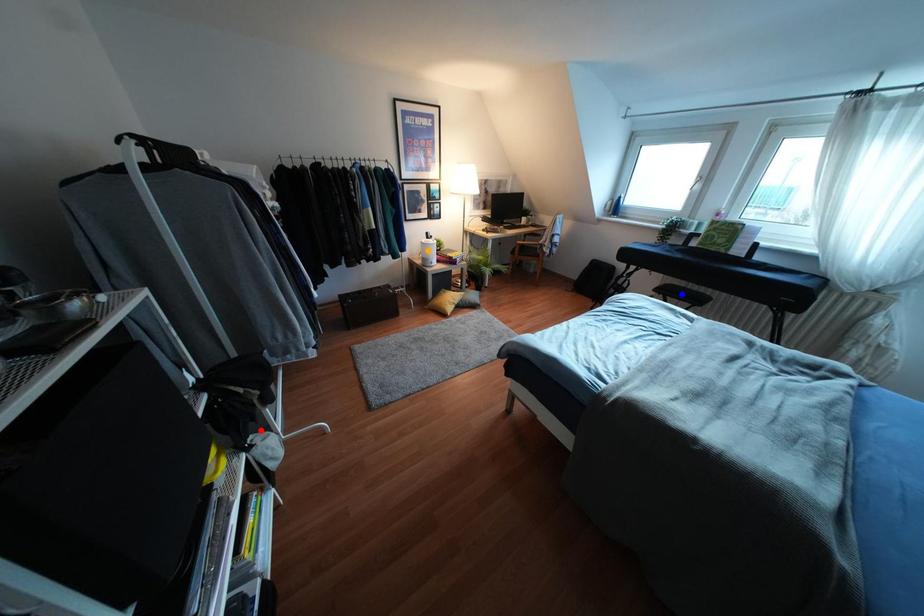
Order these from nearest to farthest:
blue point
orange point
red point

red point, blue point, orange point